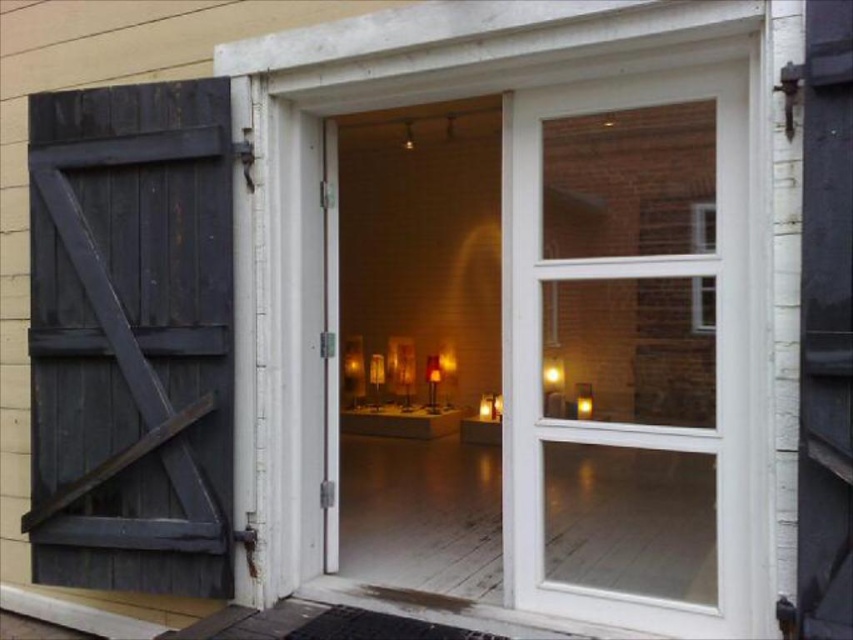
Question: Which object is the farthest from the dark wood barn door at left?

Choices:
 (A) clear glass window at upper right
 (B) clear glass door at center

Answer: (A)

Question: Is clear glass door at center closer to camera compared to dark wood barn door at left?

Choices:
 (A) yes
 (B) no

Answer: (A)

Question: Is clear glass door at center thinner than dark wood barn door at left?

Choices:
 (A) yes
 (B) no

Answer: (A)

Question: Which point is closer to the camera?

Choices:
 (A) (637, 316)
 (B) (115, 93)
 (C) (711, 244)

Answer: (C)

Question: Does dark wood barn door at left have a smaller size compared to clear glass window at upper right?

Choices:
 (A) yes
 (B) no

Answer: (B)

Question: Which point appears farthest from the camera in this image?

Choices:
 (A) (223, 460)
 (B) (608, 552)
 (C) (711, 300)

Answer: (A)